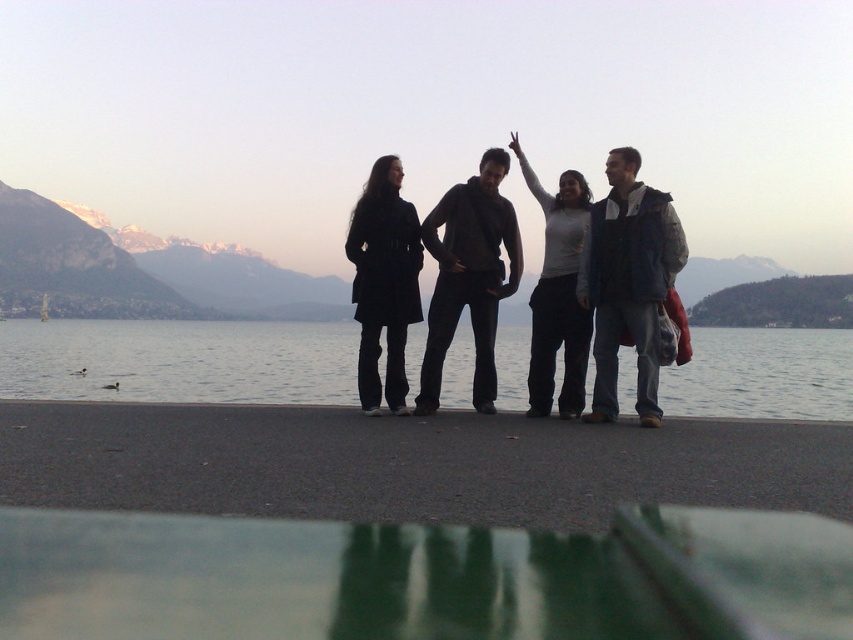
Where is `transparent water at lower center`? The height and width of the screenshot is (640, 853). transparent water at lower center is located at coordinates (178, 360).

Who is more forward, (332, 376) or (645, 243)?

Point (645, 243) is in front.

This screenshot has width=853, height=640. What are the coordinates of `transparent water at lower center` in the screenshot? It's located at (178, 360).

From the picture: Can you confirm if dark blue jacket at right is positioned below black matte coat at left?

Yes, dark blue jacket at right is below black matte coat at left.

Image resolution: width=853 pixels, height=640 pixels. What are the coordinates of `dark blue jacket at right` in the screenshot? It's located at (628, 282).

Which is below, transparent water at lower center or black matte coat at left?

transparent water at lower center is lower down.

Describe the element at coordinates (178, 360) in the screenshot. Image resolution: width=853 pixels, height=640 pixels. I see `transparent water at lower center` at that location.

Image resolution: width=853 pixels, height=640 pixels. In order to click on transparent water at lower center in this screenshot , I will do `click(178, 360)`.